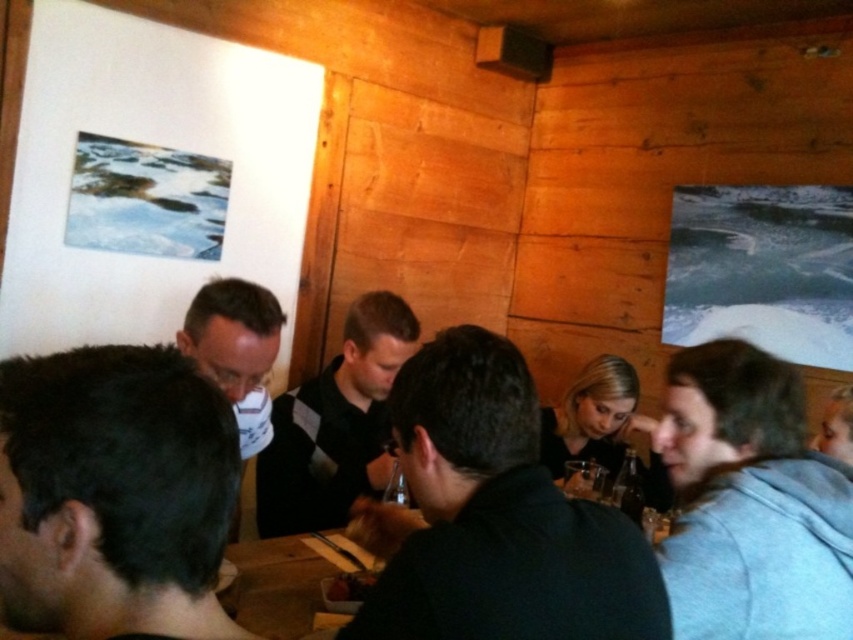
You are a photographer trying to capture a closeup of the dark brown hair at lower left and the dark glass bottle at lower right. Since you can only focus on one subject at a time, which one should you focus on first if you want to ensure the other is in the background?

You should focus on the dark brown hair at lower left first because it is above the dark glass bottle at lower right, so the bottle will naturally be in the background if the hair is in focus.

You are standing in the room and want to place a new painting between the two existing framed pictures on the walls. The first picture is at point (257,321) and the second at point (637,476). Which of these two points is closer to you so you can measure the distance for hanging the new painting?

Point (257,321) is closer to the viewer than point (637,476), so you should measure from there to ensure proper placement of the new painting.